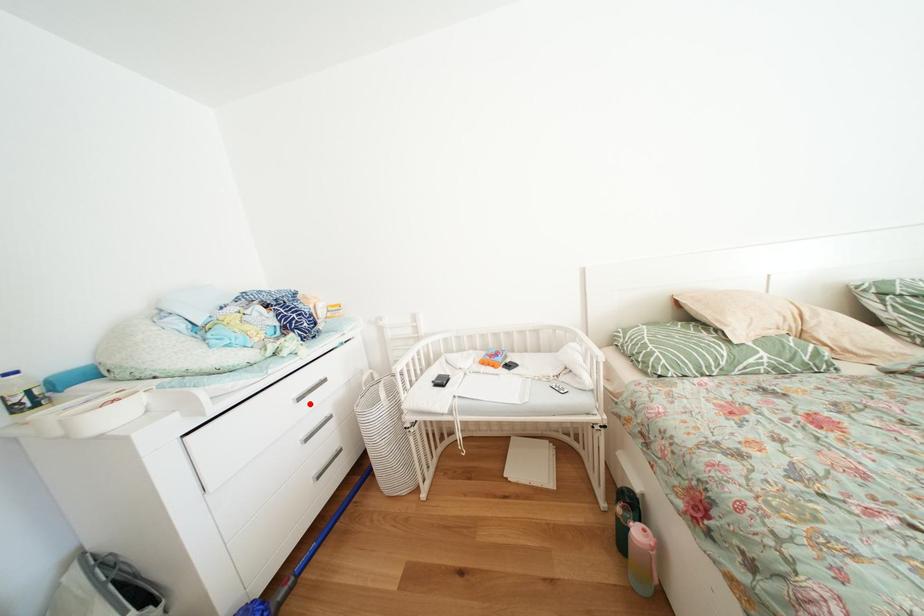
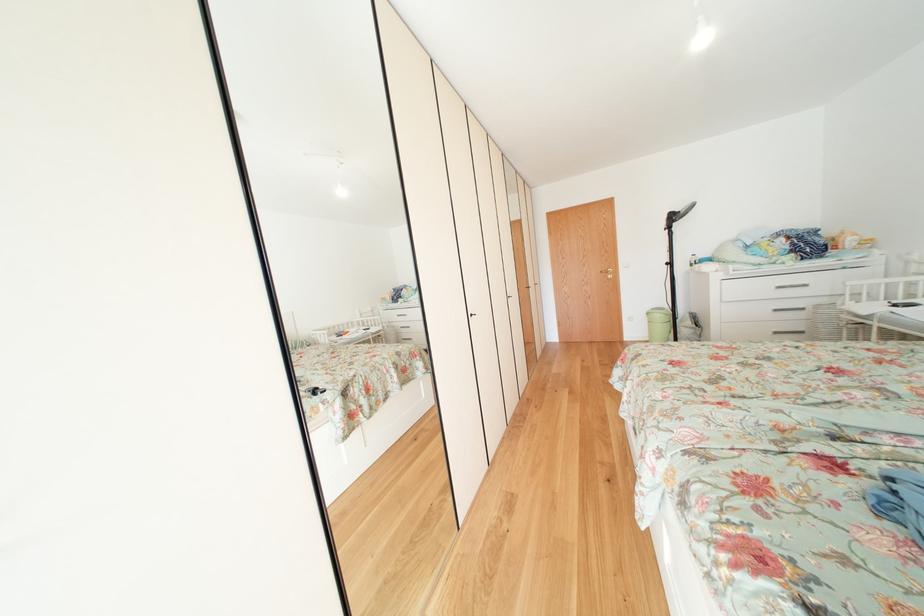
Locate, in the second image, the point that corresponds to the highlighted location in the first image.

(787, 292)